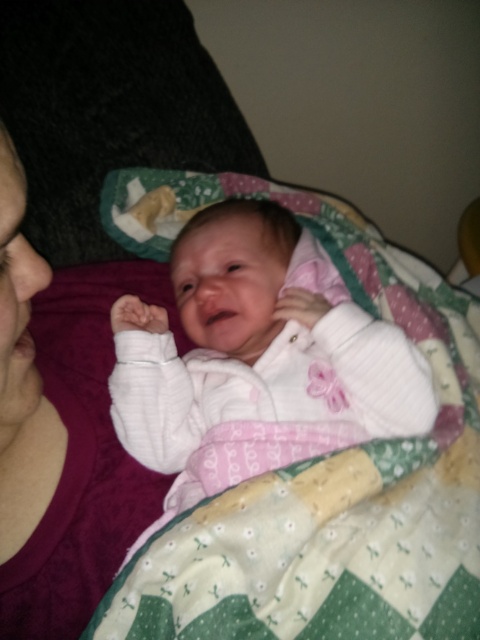
Is white soft baby at center above matte purple fabric at left?

Correct, white soft baby at center is located above matte purple fabric at left.

Does point (307, 444) come closer to viewer compared to point (108, 442)?

Yes, it is.

What do you see at coordinates (255, 358) in the screenshot?
I see `white soft baby at center` at bounding box center [255, 358].

In order to click on white soft baby at center in this screenshot , I will do point(255,358).